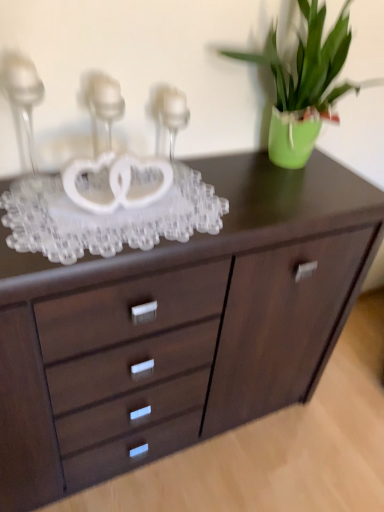
The image size is (384, 512). What are the coordinates of `vacant area to the right of clear glass candle holder at center, placed as the first candle holder when sorted from right to left` in the screenshot? It's located at (203, 180).